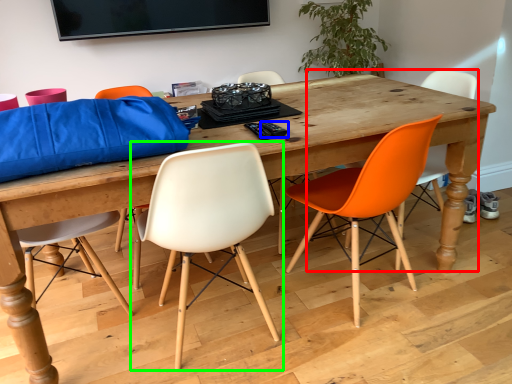
Question: Which object is positioned farthest from chair (highlighted by a red box)? Select from remote control (highlighted by a blue box) and chair (highlighted by a green box).

Choices:
 (A) remote control
 (B) chair

Answer: (B)